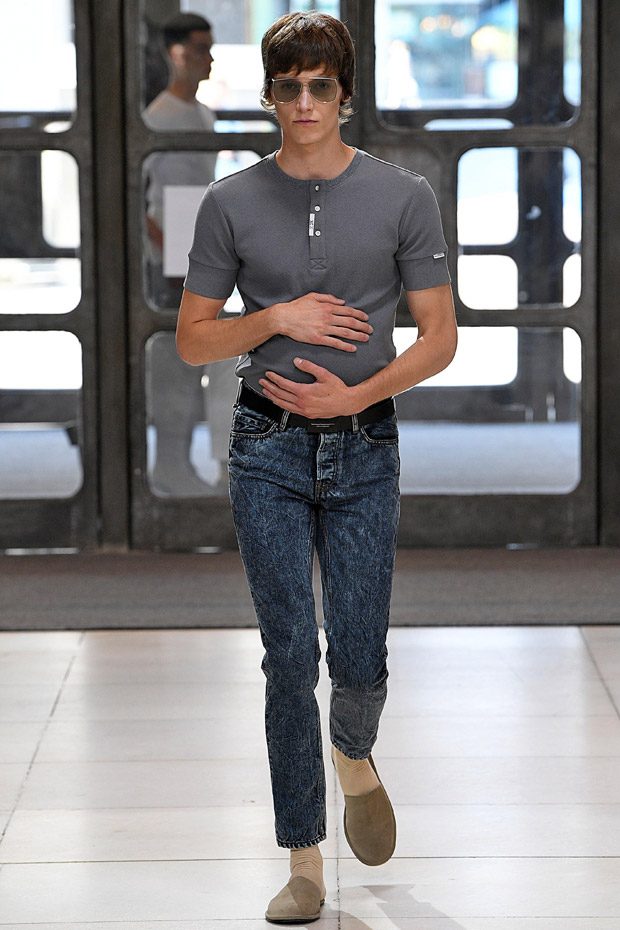
Identify the location of floor. This screenshot has height=930, width=620. (205, 788), (483, 785).